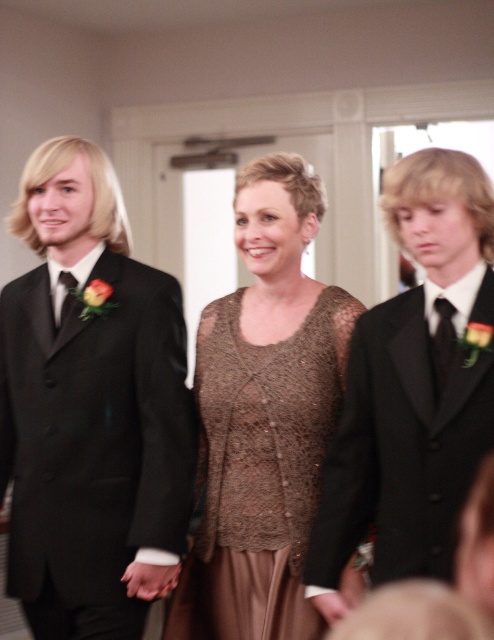
In the scene shown: Can you confirm if brown knitted sweater at center is positioned above matte black tie at left?

Actually, brown knitted sweater at center is below matte black tie at left.

Between brown knitted sweater at center and matte black tie at left, which one has more height?

With more height is brown knitted sweater at center.

Is point (235, 572) closer to camera compared to point (64, 276)?

Yes, it is in front of point (64, 276).

Locate an element on the screen. The image size is (494, 640). brown knitted sweater at center is located at coordinates (263, 417).

Who is shorter, brown knitted sweater at center or black satin tie at right?

With less height is black satin tie at right.

Between point (309, 314) and point (443, 372), which one is positioned behind?

The point (309, 314) is more distant.

Does point (171, 632) come behind point (446, 352)?

Yes, point (171, 632) is farther from viewer.

Where is `brown knitted sweater at center`? This screenshot has width=494, height=640. brown knitted sweater at center is located at coordinates (263, 417).

Between point (50, 486) and point (444, 362), which one is positioned in front?

Point (444, 362) is more forward.

Does point (193, 432) come behind point (437, 346)?

Yes, it is behind point (437, 346).

At what (x,y) coordinates should I click in order to perform the action: click on matte black suit at left. Please return your answer as a coordinate pair (x, y). The width and height of the screenshot is (494, 640). Looking at the image, I should click on (90, 410).